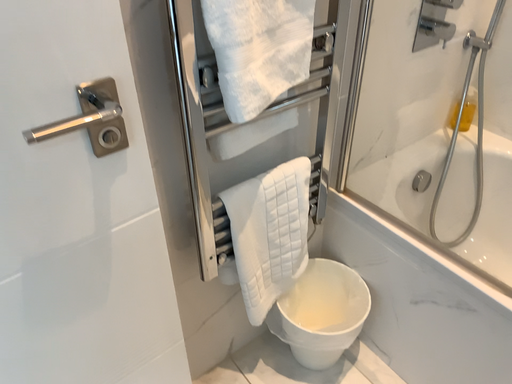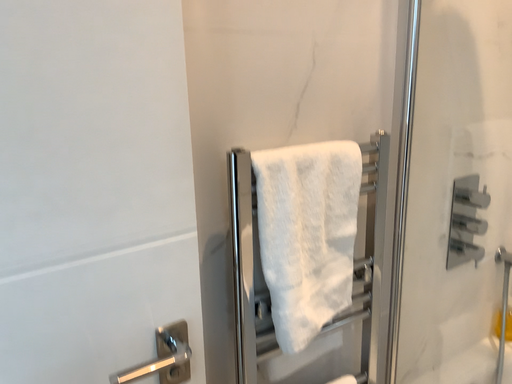
Question: How did the camera likely rotate when shooting the video?

Choices:
 (A) rotated downward
 (B) rotated upward

Answer: (B)